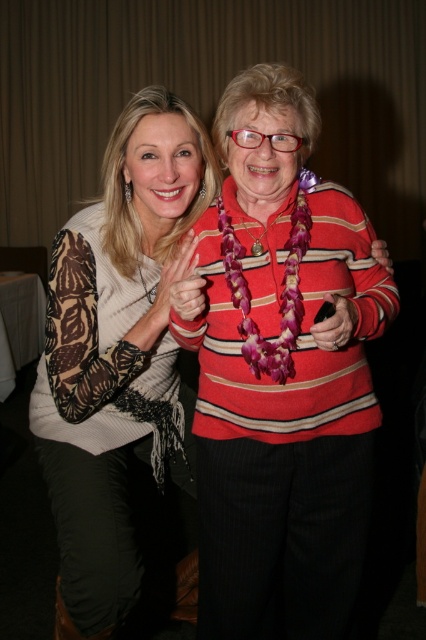
Question: Where is matte pink fabric at center located in relation to matte black phone at center in the image?

Choices:
 (A) right
 (B) left

Answer: (B)

Question: Does matte white sweater at center appear under matte red sweater at center?

Choices:
 (A) no
 (B) yes

Answer: (B)

Question: Which is farther from the matte black phone at center?

Choices:
 (A) matte white sweater at center
 (B) striped sweater at center
 (C) matte red sweater at center

Answer: (A)

Question: Considering the real-world distances, which object is closest to the matte white sweater at center?

Choices:
 (A) matte red sweater at center
 (B) matte pink fabric at center

Answer: (B)

Question: Which object is the closest to the matte pink fabric at center?

Choices:
 (A) matte white sweater at center
 (B) striped sweater at center

Answer: (A)

Question: Can you confirm if matte pink fabric at center is wider than matte black phone at center?

Choices:
 (A) no
 (B) yes

Answer: (B)